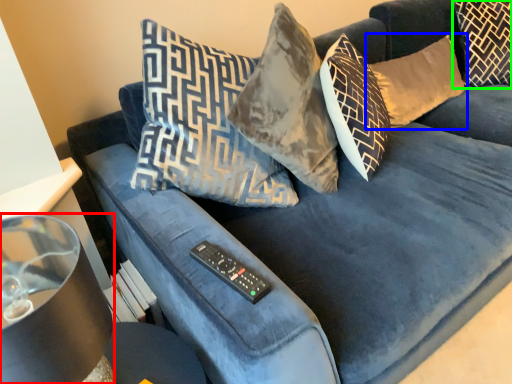
Question: Which object is positioned closest to lamp (highlighted by a red box)? Select from pillow (highlighted by a blue box) and pillow (highlighted by a green box).

Choices:
 (A) pillow
 (B) pillow

Answer: (A)